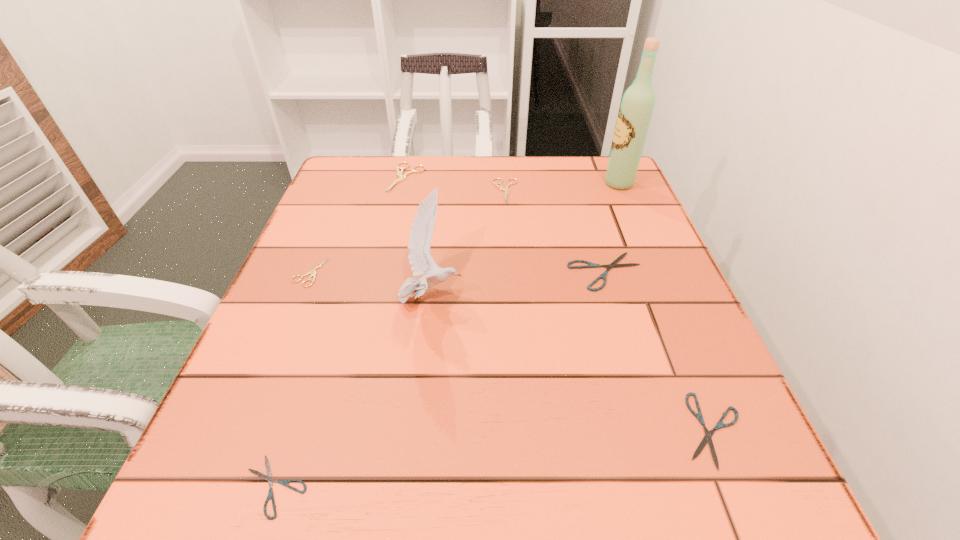
I want to click on beige shears that is the second nearest to the second smallest black shears, so click(313, 272).

Identify which beige shears is located as the nearest to the tallest shears. Please provide its 2D coordinates. Your answer should be formatted as a tuple, i.e. [(x, y)], where the tuple contains the x and y coordinates of a point satisfying the conditions above.

[(500, 187)]

Identify which black shears is the nearest to the third tallest object. Please provide its 2D coordinates. Your answer should be formatted as a tuple, i.e. [(x, y)], where the tuple contains the x and y coordinates of a point satisfying the conditions above.

[(614, 264)]

Select which black shears is the second closest to the leftmost black shears. Please provide its 2D coordinates. Your answer should be formatted as a tuple, i.e. [(x, y)], where the tuple contains the x and y coordinates of a point satisfying the conditions above.

[(707, 438)]

This screenshot has height=540, width=960. What are the coordinates of `vacant space that satisfies the following two spatial constraints: 1. at the tip of the beak of the white gull; 2. on the right side of the second smallest black shears` in the screenshot? It's located at (416, 430).